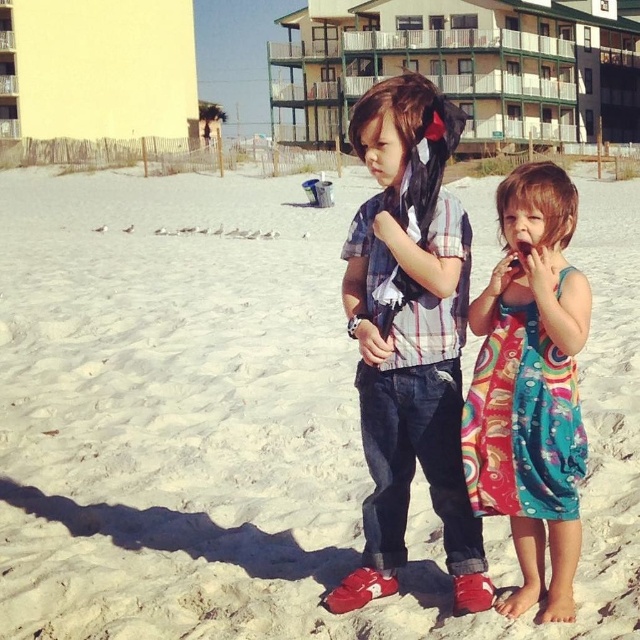
Does plaid cotton shirt at center appear over yellow painted building at upper left?

No.

Is point (410, 141) farther from viewer compared to point (193, 131)?

No, (410, 141) is in front of (193, 131).

Locate an element on the screen. plaid cotton shirt at center is located at coordinates (410, 337).

At what (x,y) coordinates should I click in order to perform the action: click on plaid cotton shirt at center. Please return your answer as a coordinate pair (x, y). Looking at the image, I should click on (410, 337).

Between white sand at center and plaid cotton shirt at center, which one is positioned lower?

plaid cotton shirt at center is below.

Which is above, white sand at center or plaid cotton shirt at center?

white sand at center is higher up.

Does point (260, 316) come in front of point (436, 332)?

No, it is behind (436, 332).

Image resolution: width=640 pixels, height=640 pixels. Find the location of `white sand at center`. white sand at center is located at coordinates (244, 417).

Which of these two, white sand at center or yellow painted building at upper left, stands taller?

yellow painted building at upper left is taller.

Is white sand at center bigger than yellow painted building at upper left?

No, white sand at center is not bigger than yellow painted building at upper left.

Who is more forward, (584, 380) or (116, 115)?

Positioned in front is point (584, 380).

Where is `white sand at center`? This screenshot has height=640, width=640. white sand at center is located at coordinates (244, 417).